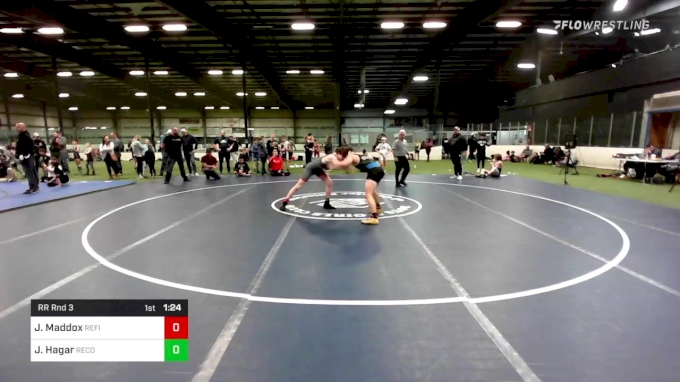
The height and width of the screenshot is (382, 680). Find the location of `sheet`. sheet is located at coordinates (20, 160).